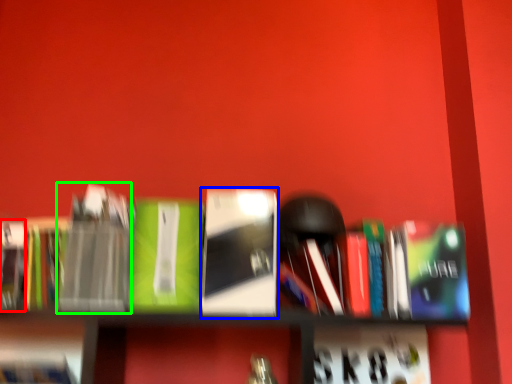
Question: Which object is positioned farthest from paperback book (highlighted by a red box)? Select from book (highlighted by a blue box) and paperback book (highlighted by a green box).

Choices:
 (A) book
 (B) paperback book

Answer: (A)